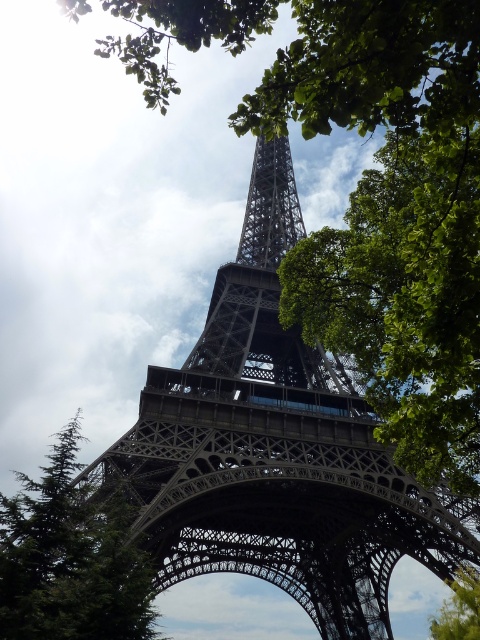
You are standing at the base of the Eiffel Tower and looking up. You notice two points marked on the tower. One is at coordinates point (184, 406) and the other at point (32, 548). Which point is closer to your eyes?

Point (184, 406) is further to the camera than point (32, 548), so the point closer to your eyes is point (32, 548).

You are standing at the point where the photo was taken. You want to take a photo of the metallic lattice tower at center. Where should you point your camera to capture it in the frame?

You should point your camera towards the center of the frame at the coordinates point (276,449) to capture the metallic lattice tower at center.

You are a photographer planning to capture the Eiffel Tower and the trees in the foreground. Given that your camera can focus on objects within a 20 meter range, will both the metallic lattice tower at center and the green leafy tree at center be in focus?

The metallic lattice tower at center and the green leafy tree at center are 24.38 meters apart. Since the camera can only focus within a 20 meter range, the distance between them exceeds the focus range. Therefore, both cannot be in focus simultaneously.